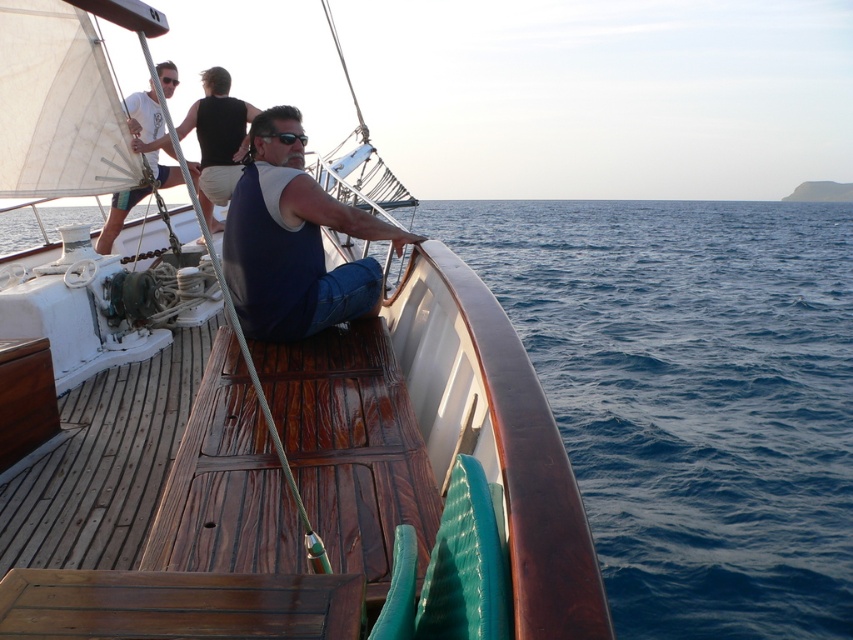
You are on a sailboat and need to choose between the black plastic goggles at center and the black plastic goggles at upper center. Which pair is smaller in size?

The black plastic goggles at center is smaller in size compared to the black plastic goggles at upper center because it occupies less space.

You are standing on the wooden deck at center and want to move to the blue denim jeans at center. Which direction should you move to reach them?

Since the wooden deck at center is on the right side of the blue denim jeans at center, you should move to the left to reach them.